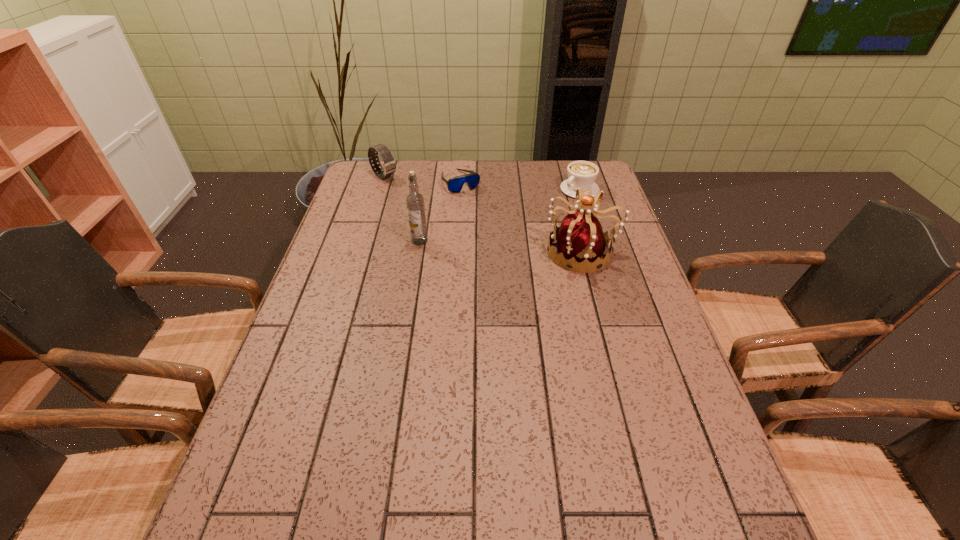
Where is `vacant space located on the face of the watch`? vacant space located on the face of the watch is located at coordinates (449, 221).

Find the location of a particular element. The height and width of the screenshot is (540, 960). free space located 0.310m on the face of the watch is located at coordinates (447, 219).

Locate an element on the screen. cappuccino that is at the far edge is located at coordinates pyautogui.click(x=581, y=174).

In order to click on sunglasses present at the far edge in this screenshot , I will do `click(455, 184)`.

Where is `watch at the far edge`? Image resolution: width=960 pixels, height=540 pixels. watch at the far edge is located at coordinates (389, 165).

Identify the location of object present at the left edge. The height and width of the screenshot is (540, 960). (389, 165).

This screenshot has width=960, height=540. Find the location of `tiara present at the right edge`. tiara present at the right edge is located at coordinates (581, 240).

Locate an element on the screen. The image size is (960, 540). cappuccino present at the right edge is located at coordinates (x=581, y=174).

You are a GUI agent. You are given a task and a screenshot of the screen. Output one action in this format:
    pyautogui.click(x=<x>, y=<y>)
    Task: Click on the object located at the far left corner
    
    Given the screenshot: What is the action you would take?
    389,165

The image size is (960, 540). Identify the location of object at the far right corner. (581, 174).